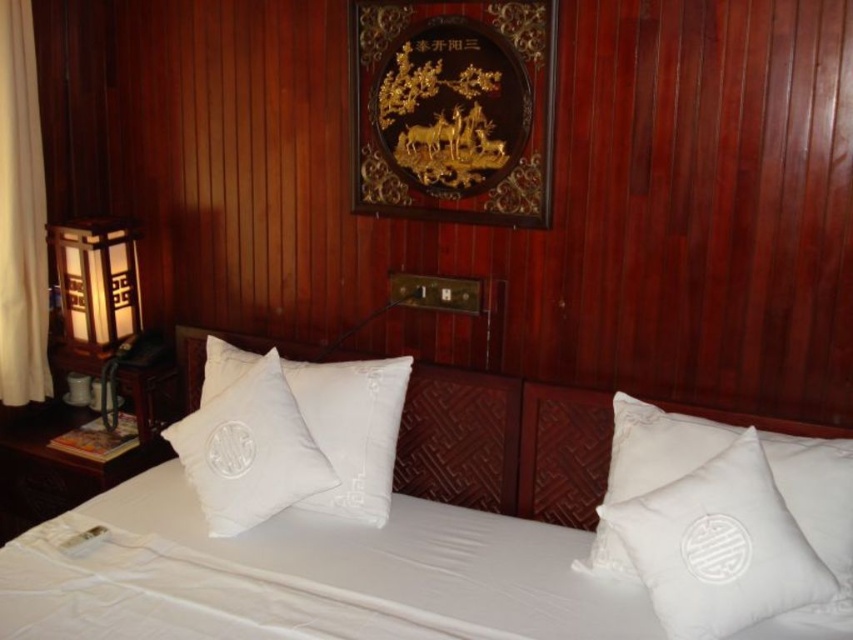
You are standing in the bedroom and want to open the window to let some fresh air in. The window is behind the white fabric curtain at left and the matte wooden lamp at left. Which object should you move first to access the window?

You should move the white fabric curtain at left first because it is positioned to the left of the matte wooden lamp at left, meaning it is closer to the window and must be moved before the lamp to access the window.

You are standing in the bedroom and want to hang a new painting. You have two options for placement. One is above the white quilted pillow at center, and the other is where the white fabric curtain at left is currently hanging. Which location is higher up?

The white fabric curtain at left is located above the white quilted pillow at center, so placing the painting there would be higher up.